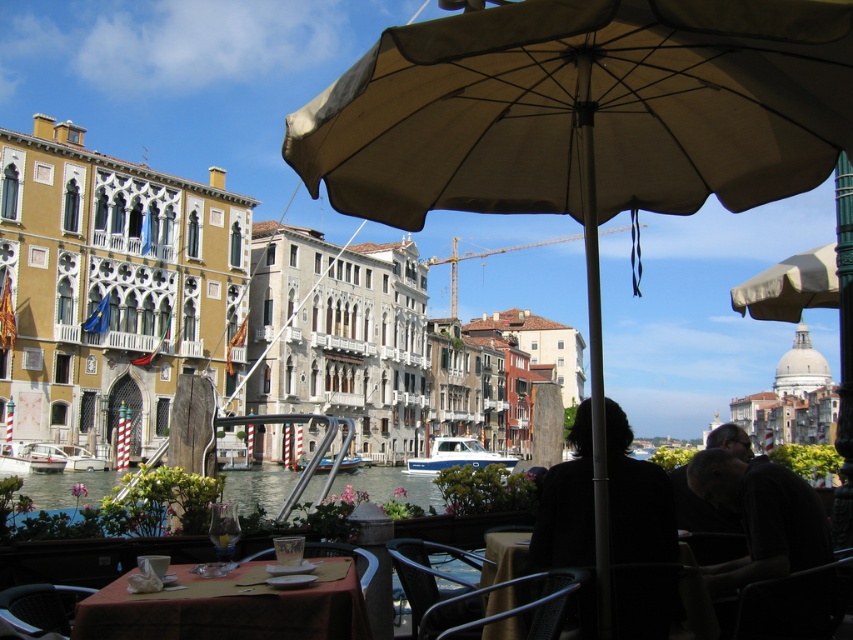
You are a person sitting at the dark brown leather chair at lower right and want to grab the beige fabric umbrella at center. Can you reach it without moving from your seat?

The beige fabric umbrella at center is 11.03 meters away from dark brown leather chair at lower right, so you cannot reach it without moving from your seat.

You are a photographer setting up a tripod to capture the canal and the dining table. Since the matte orange table at lower left and the clear water at center are both in your shot, which object will appear taller in the photograph?

The clear water at center appears taller in the photograph because the matte orange table at lower left is not as tall as it.

You are a photographer standing at the canal edge, wanting to take a photo of the matte orange table at lower left and metallic silver chair at lower left. If you want to focus on the object that is nearest to you, which one should you aim your camera at?

The matte orange table at lower left is closer to the viewer than the metallic silver chair at lower left, so you should aim your camera at the matte orange table at lower left to focus on the nearest object.